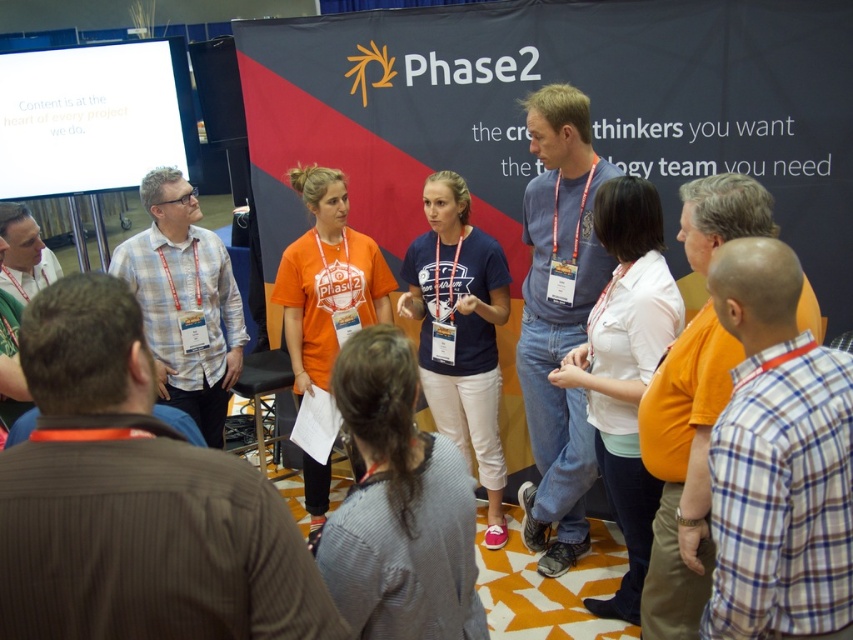
You are a photographer positioned at the camera. You need to capture a closeup shot of the brown pinstripe shirt at center. Considering the distance between you and the subject, is it possible to achieve a clear closeup without moving closer?

The distance between the brown pinstripe shirt at center and the camera is 38.86 inches. Since this distance is relatively close, a photographer can likely achieve a clear closeup shot without needing to move closer, provided the camera has sufficient zoom or macro capabilities.

Consider the image. You are attending a conference and notice two presenters in the center of the group. The brown pinstripe shirt at center and the white checkered shirt at center. Which presenter is shorter?

The brown pinstripe shirt at center is not as tall as the white checkered shirt at center, so the presenter in the brown pinstripe shirt at center is shorter.